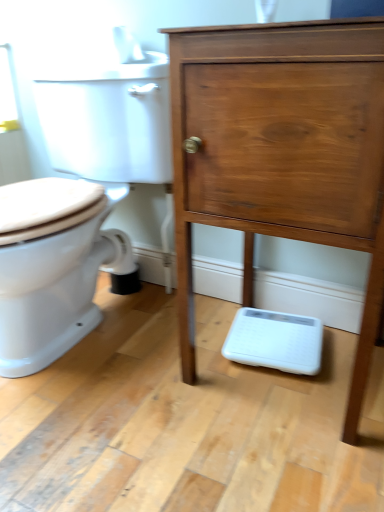
The image size is (384, 512). Identify the location of vacant space in matte wood chest of drawers at center (from a real-world perspective). (297, 381).